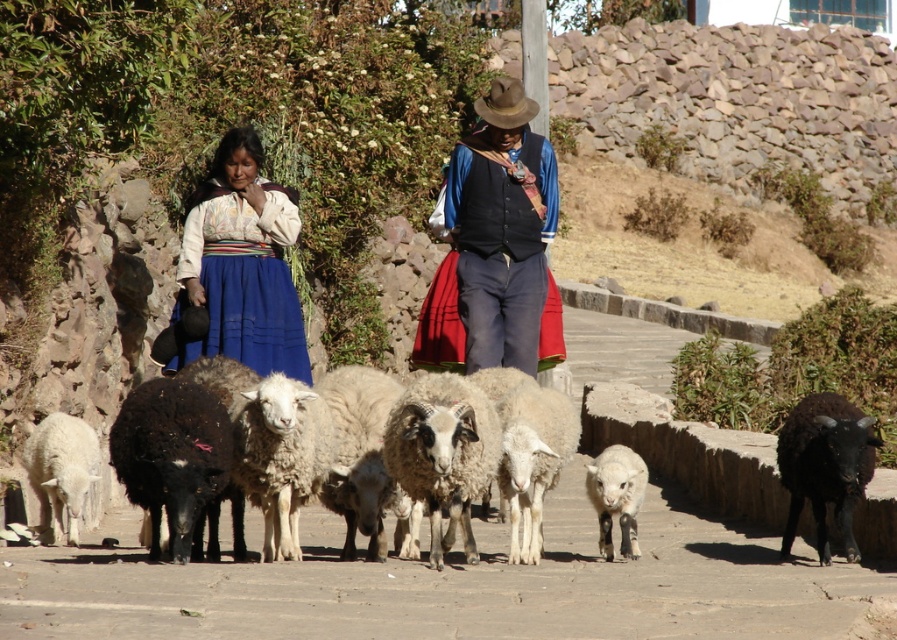
Between black woolen goat at lower right and white woolly sheep at lower left, which one has more height?

white woolly sheep at lower left is taller.

Which is below, black woolen goat at lower right or white woolly sheep at lower left?

black woolen goat at lower right is below.

Is point (869, 419) positioned before point (46, 508)?

Yes, it is in front of point (46, 508).

This screenshot has height=640, width=897. What are the coordinates of `black woolen goat at lower right` in the screenshot? It's located at (x=825, y=467).

Between velvet black vest at center and brown felt cowboy hat at center, which one is positioned lower?

Positioned lower is velvet black vest at center.

Consider the image. Is velvet black vest at center below brown felt cowboy hat at center?

Yes, velvet black vest at center is below brown felt cowboy hat at center.

Between point (508, 220) and point (497, 122), which one is positioned in front?

Point (497, 122) is more forward.

This screenshot has height=640, width=897. I want to click on velvet black vest at center, so click(x=501, y=228).

Between velvet black vest at center and black woolen goat at lower right, which one is positioned lower?

Positioned lower is black woolen goat at lower right.

Can you confirm if velvet black vest at center is taller than black woolen goat at lower right?

Yes.

Is point (457, 273) less distant than point (811, 483)?

No, it is behind (811, 483).

This screenshot has width=897, height=640. I want to click on velvet black vest at center, so (501, 228).